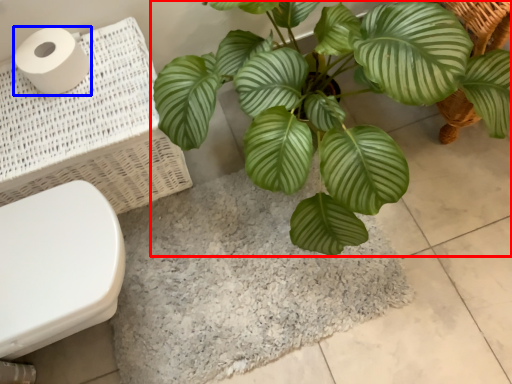
Question: Among these objects, which one is farthest to the camera, houseplant (highlighted by a red box) or toilet paper (highlighted by a blue box)?

Choices:
 (A) houseplant
 (B) toilet paper

Answer: (B)